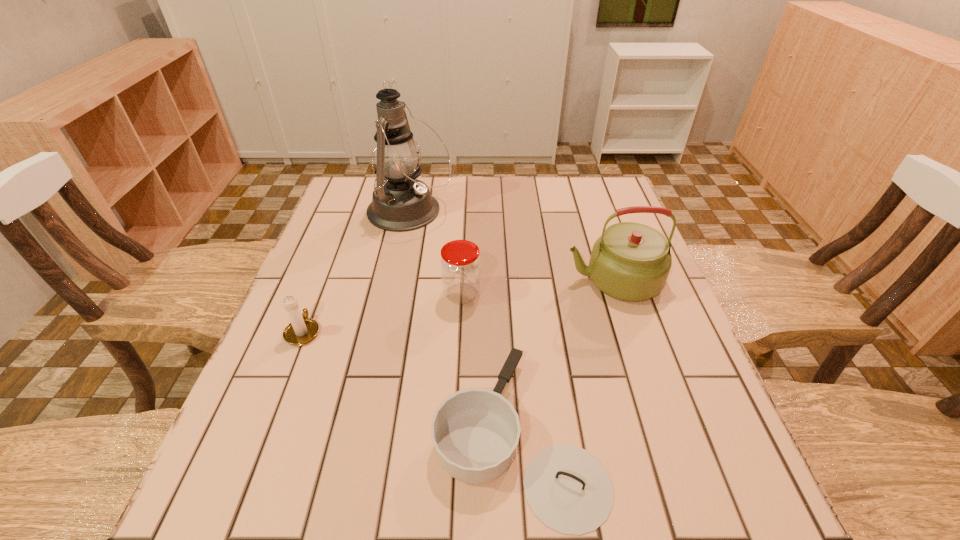
Identify the location of vacant space situated at the spout of the kettle. This screenshot has width=960, height=540. (545, 280).

Identify the location of free space located at the spout of the kettle. (449, 280).

Find the location of a particular element. free location located on the right of the jar is located at coordinates (601, 294).

I want to click on vacant space located on the handle side of the candle holder, so click(x=330, y=263).

Find the location of a particular element. vacant region located 0.090m on the handle side of the candle holder is located at coordinates (320, 289).

At what (x,y) coordinates should I click in order to perform the action: click on vacant space located 0.230m on the handle side of the candle holder. Please return your answer as a coordinate pair (x, y). The width and height of the screenshot is (960, 540). Looking at the image, I should click on (333, 253).

Identify the location of blank space located on the left of the saucepan. Image resolution: width=960 pixels, height=540 pixels. (252, 434).

Image resolution: width=960 pixels, height=540 pixels. What are the coordinates of `object that is at the far edge` in the screenshot? It's located at (400, 202).

Identify the location of object positioned at the near edge. (475, 431).

At what (x,y) coordinates should I click in order to perform the action: click on oil lamp that is positioned at the left edge. Please return your answer as a coordinate pair (x, y). The width and height of the screenshot is (960, 540). Looking at the image, I should click on (400, 202).